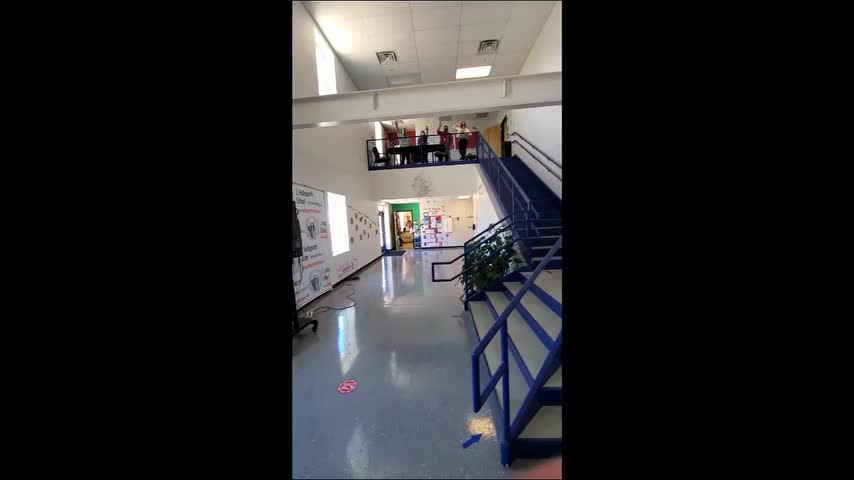
Image resolution: width=854 pixels, height=480 pixels. I want to click on window, so click(331, 228), click(320, 76).